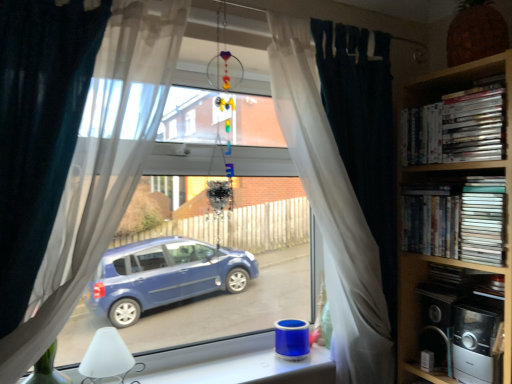
What do you see at coordinates (437, 324) in the screenshot? The height and width of the screenshot is (384, 512). I see `metallic silver microwave at lower right, arranged as the first appliance when viewed from the back` at bounding box center [437, 324].

Describe the element at coordinates (456, 220) in the screenshot. I see `matte plastic dvds at right, acting as the 2th book starting from the bottom` at that location.

Locate an element on the screen. This screenshot has width=512, height=384. white matte lamp at lower left is located at coordinates (106, 357).

At what (x,y) coordinates should I click in order to perform the action: click on teal fabric curtain at center, the first curtain positioned from the right. Please return your answer as a coordinate pair (x, y). This screenshot has width=512, height=384. Looking at the image, I should click on (331, 209).

The width and height of the screenshot is (512, 384). Identify the location of transparent glass window at lower center. (233, 364).

From the picture: From a real-world perspective, between metallic silver microwave at lower right, arranged as the first appliance when viewed from the back, and black matte book at right, the 1th book positioned from the bottom, who is vertically higher?

black matte book at right, the 1th book positioned from the bottom.

Which of these two, metallic silver microwave at lower right, arranged as the first appliance when viewed from the back, or black matte book at right, the 1th book positioned from the bottom, stands shorter?

black matte book at right, the 1th book positioned from the bottom.

In the image, is metallic silver microwave at lower right, arranged as the first appliance when viewed from the back, on the left side or the right side of black matte book at right, the 1th book positioned from the bottom?

From the image, it's evident that metallic silver microwave at lower right, arranged as the first appliance when viewed from the back, is to the left of black matte book at right, the 1th book positioned from the bottom.

From the image's perspective, relative to black matte book at right, the 1th book positioned from the bottom, is metallic silver microwave at lower right, arranged as the first appliance when viewed from the back, above or below?

metallic silver microwave at lower right, arranged as the first appliance when viewed from the back, is below black matte book at right, the 1th book positioned from the bottom.

Is white matte lamp at lower left oriented towards metallic silver microwave at lower right, arranged as the first appliance when viewed from the back?

No.

Is white matte lamp at lower left with metallic silver microwave at lower right, arranged as the first appliance when viewed from the back?

No, white matte lamp at lower left is not making contact with metallic silver microwave at lower right, arranged as the first appliance when viewed from the back.

Locate an element on the screen. The height and width of the screenshot is (384, 512). lamp on the left of metallic silver microwave at lower right, positioned as the 2th appliance in front-to-back order is located at coordinates (106, 357).

Considering the relative sizes of transparent glass window at lower center and matte plastic dvds at right, acting as the 2th book starting from the bottom, in the image provided, is transparent glass window at lower center taller than matte plastic dvds at right, acting as the 2th book starting from the bottom,?

Incorrect, the height of transparent glass window at lower center is not larger of that of matte plastic dvds at right, acting as the 2th book starting from the bottom.

Considering the sizes of objects transparent glass window at lower center and matte plastic dvds at right, acting as the 2th book starting from the bottom, in the image provided, who is bigger, transparent glass window at lower center or matte plastic dvds at right, acting as the 2th book starting from the bottom,?

Bigger between the two is transparent glass window at lower center.

From a real-world perspective, which object stands above the other?

matte plastic dvds at right, the second book viewed from the top.

Is transparent glass window at lower center inside or outside of matte plastic dvds at right, the second book viewed from the top?

transparent glass window at lower center exists outside the volume of matte plastic dvds at right, the second book viewed from the top.

Consider the image. Can you confirm if metallic silver toaster at lower right, which appears as the 2th appliance when viewed from the back, is smaller than white sheer curtain at center, which appears as the second curtain when viewed from the right?

Yes, metallic silver toaster at lower right, which appears as the 2th appliance when viewed from the back, is smaller than white sheer curtain at center, which appears as the second curtain when viewed from the right.

Considering the positions of points (495, 338) and (90, 135), is point (495, 338) farther from camera compared to point (90, 135)?

Yes, point (495, 338) is farther from viewer.

Is metallic silver toaster at lower right, which is counted as the 1th appliance, starting from the front, placed right next to white sheer curtain at center, the 1th curtain positioned from the front?

No, metallic silver toaster at lower right, which is counted as the 1th appliance, starting from the front, is not making contact with white sheer curtain at center, the 1th curtain positioned from the front.

Which is more to the left, metallic silver toaster at lower right, which appears as the 2th appliance when viewed from the back, or white sheer curtain at center, arranged as the 2th curtain when viewed from the back?

From the viewer's perspective, white sheer curtain at center, arranged as the 2th curtain when viewed from the back, appears more on the left side.

Can you confirm if metallic silver toaster at lower right, which appears as the 2th appliance when viewed from the back, is smaller than metallic silver microwave at lower right, positioned as the 2th appliance in front-to-back order?

No, metallic silver toaster at lower right, which appears as the 2th appliance when viewed from the back, is not smaller than metallic silver microwave at lower right, positioned as the 2th appliance in front-to-back order.

Is metallic silver toaster at lower right, which is counted as the 1th appliance, starting from the front, inside or outside of metallic silver microwave at lower right, arranged as the first appliance when viewed from the back?

metallic silver toaster at lower right, which is counted as the 1th appliance, starting from the front, is not enclosed by metallic silver microwave at lower right, arranged as the first appliance when viewed from the back.

From a real-world perspective, who is located higher, metallic silver toaster at lower right, which appears as the 2th appliance when viewed from the back, or metallic silver microwave at lower right, positioned as the 2th appliance in front-to-back order?

metallic silver toaster at lower right, which appears as the 2th appliance when viewed from the back, is physically above.

Considering the sizes of objects metallic silver toaster at lower right, which appears as the 2th appliance when viewed from the back, and metallic silver microwave at lower right, arranged as the first appliance when viewed from the back, in the image provided, who is taller, metallic silver toaster at lower right, which appears as the 2th appliance when viewed from the back, or metallic silver microwave at lower right, arranged as the first appliance when viewed from the back,?

With more height is metallic silver toaster at lower right, which appears as the 2th appliance when viewed from the back.

Are transparent glass window at lower center and metallic silver microwave at lower right, positioned as the 2th appliance in front-to-back order, making contact?

transparent glass window at lower center and metallic silver microwave at lower right, positioned as the 2th appliance in front-to-back order, are not in contact.

Is transparent glass window at lower center facing away from metallic silver microwave at lower right, positioned as the 2th appliance in front-to-back order?

That's not correct — transparent glass window at lower center is not looking away from metallic silver microwave at lower right, positioned as the 2th appliance in front-to-back order.

Can you tell me how much transparent glass window at lower center and metallic silver microwave at lower right, positioned as the 2th appliance in front-to-back order, differ in facing direction?

There is a 92.3-degree angle between the facing directions of transparent glass window at lower center and metallic silver microwave at lower right, positioned as the 2th appliance in front-to-back order.

Consider the image. Which object is positioned more to the left, transparent glass window at lower center or metallic silver microwave at lower right, positioned as the 2th appliance in front-to-back order?

Positioned to the left is transparent glass window at lower center.

Does white matte lamp at lower left lie behind matte plastic dvds at right, the second book viewed from the top?

No, white matte lamp at lower left is closer to the viewer.

In the scene shown: Considering the sizes of objects white matte lamp at lower left and matte plastic dvds at right, acting as the 2th book starting from the bottom, in the image provided, who is shorter, white matte lamp at lower left or matte plastic dvds at right, acting as the 2th book starting from the bottom,?

Standing shorter between the two is white matte lamp at lower left.

Does white matte lamp at lower left turn towards matte plastic dvds at right, acting as the 2th book starting from the bottom?

No.

Is point (113, 373) farther from camera compared to point (426, 186)?

No, (113, 373) is in front of (426, 186).

Where is `appliance on the left of black matte book at right, the 1th book positioned from the bottom`? This screenshot has height=384, width=512. appliance on the left of black matte book at right, the 1th book positioned from the bottom is located at coordinates (437, 324).

From the white matte lamp at lower left, count 2nd appliances backward and point to it. Please provide its 2D coordinates.

[(437, 324)]

Based on their spatial positions, is white sheer curtain at center, the 1th curtain positioned from the front, or teal fabric curtain at center, positioned as the second curtain in left-to-right order, further from transparent glass window at lower center?

white sheer curtain at center, the 1th curtain positioned from the front, is further to transparent glass window at lower center.

Estimate the real-world distances between objects in this image. Which object is further from white glossy dvds at upper right, arranged as the first book when viewed from the top, teal fabric curtain at center, positioned as the second curtain in front-to-back order, or black matte book at right, which is the third book from top to bottom?

black matte book at right, which is the third book from top to bottom.

Consider the image. Looking at the image, which one is located further to black matte book at right, which is the third book from top to bottom, transparent glass window at lower center or metallic silver toaster at lower right, which appears as the 2th appliance when viewed from the back?

transparent glass window at lower center.

Looking at the image, which one is located further to white glossy dvds at upper right, arranged as the first book when viewed from the top, black matte book at right, the 1th book positioned from the bottom, or teal fabric curtain at center, positioned as the second curtain in front-to-back order?

black matte book at right, the 1th book positioned from the bottom, lies further to white glossy dvds at upper right, arranged as the first book when viewed from the top, than the other object.

Which object lies further to the anchor point metallic silver toaster at lower right, which is counted as the 1th appliance, starting from the front, white matte lamp at lower left or white sheer curtain at center, positioned as the 1th curtain in left-to-right order?

white sheer curtain at center, positioned as the 1th curtain in left-to-right order, is positioned further to the anchor metallic silver toaster at lower right, which is counted as the 1th appliance, starting from the front.

Looking at the image, which one is located further to white glossy dvds at upper right, arranged as the first book when viewed from the top, white sheer curtain at center, arranged as the 2th curtain when viewed from the back, or metallic silver toaster at lower right, which appears as the 2th appliance when viewed from the back?

white sheer curtain at center, arranged as the 2th curtain when viewed from the back.

Estimate the real-world distances between objects in this image. Which object is closer to white glossy dvds at upper right, arranged as the first book when viewed from the top, black matte book at right, which is the third book from top to bottom, or matte plastic dvds at right, acting as the 2th book starting from the bottom?

matte plastic dvds at right, acting as the 2th book starting from the bottom, is positioned closer to the anchor white glossy dvds at upper right, arranged as the first book when viewed from the top.

From the image, which object appears to be nearer to black matte book at right, the 1th book positioned from the bottom, white glossy dvds at upper right, placed as the third book when sorted from bottom to top, or metallic silver toaster at lower right, which appears as the 2th appliance when viewed from the back?

metallic silver toaster at lower right, which appears as the 2th appliance when viewed from the back, is closer to black matte book at right, the 1th book positioned from the bottom.

At what (x,y) coordinates should I click in order to perform the action: click on book between white glossy dvds at upper right, arranged as the first book when viewed from the top, and black matte book at right, the 1th book positioned from the bottom, vertically. Please return your answer as a coordinate pair (x, y). Image resolution: width=512 pixels, height=384 pixels. Looking at the image, I should click on (x=456, y=220).

In order to click on book between white matte lamp at lower left and metallic silver microwave at lower right, arranged as the first appliance when viewed from the back in this screenshot , I will do `click(456, 220)`.

At what (x,y) coordinates should I click in order to perform the action: click on book between transparent glass window at lower center and black matte book at right, the 1th book positioned from the bottom, from left to right. Please return your answer as a coordinate pair (x, y). This screenshot has width=512, height=384. Looking at the image, I should click on (456, 220).

At what (x,y) coordinates should I click in order to perform the action: click on appliance between teal fabric curtain at center, positioned as the second curtain in left-to-right order, and metallic silver microwave at lower right, arranged as the first appliance when viewed from the back, in the vertical direction. Please return your answer as a coordinate pair (x, y). Looking at the image, I should click on (477, 345).